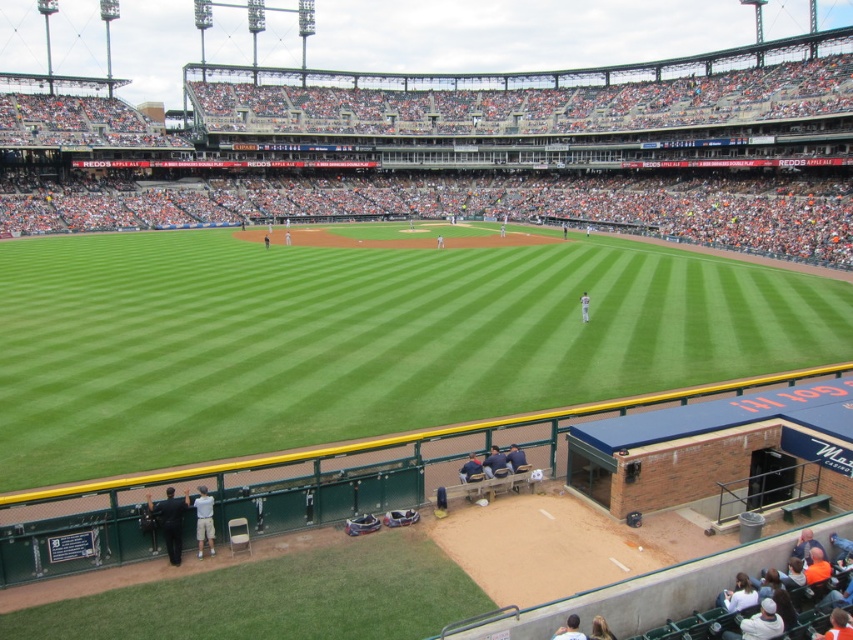
Question: Which of the following is the closest to the observer?

Choices:
 (A) light brown hair at lower center
 (B) blonde hair at lower right

Answer: (A)

Question: Is green grass field at center above white uniform at center?

Choices:
 (A) no
 (B) yes

Answer: (B)

Question: Does blue fabric jacket at lower center have a greater width compared to white uniform at center?

Choices:
 (A) no
 (B) yes

Answer: (B)

Question: Considering the real-world distances, which object is farthest from the blue fabric jacket at lower center?

Choices:
 (A) light brown hair at lower center
 (B) orange fabric cap at upper right
 (C) green grass field at center

Answer: (C)

Question: Among these objects, which one is farthest from the camera?

Choices:
 (A) dark suit at lower left
 (B) orange fabric cap at upper right
 (C) white uniform at center

Answer: (C)

Question: Is white cotton shirt at lower center smaller than orange fabric cap at upper right?

Choices:
 (A) no
 (B) yes

Answer: (A)